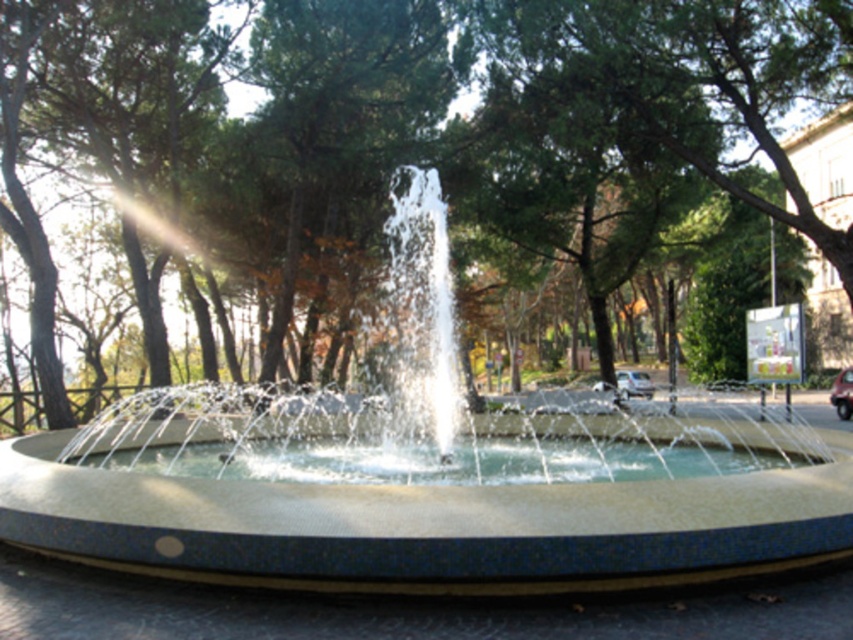
You are standing at the point with coordinates (x=426, y=476) in the image. What object are you standing on?

You are standing on the white glossy fountain at center, as the coordinates point (x=426, y=476) represent the fountain.

Based on the photo, you are a landscape architect planning to install a new pathway around the white glossy fountain at center and the green leafy tree at center. Which object requires a wider pathway to accommodate its base?

The green leafy tree at center requires a wider pathway because it is thicker than the white glossy fountain at center.

You are a photographer trying to capture the white glossy fountain at center and the green leafy tree at center in the same frame. Based on their sizes, which object should you focus on to ensure both are visible without cropping?

The white glossy fountain at center is larger in size than the green leafy tree at center, so you should focus on the white glossy fountain at center to ensure both are visible without cropping.